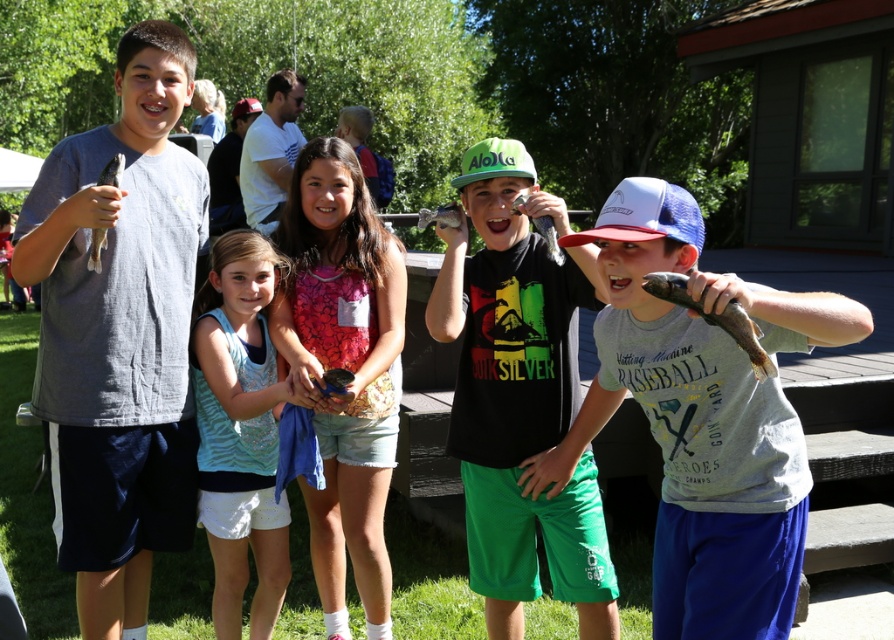
Does gray matte shirt at left have a greater width compared to shiny metallic fish at center?

No, gray matte shirt at left is not wider than shiny metallic fish at center.

Find the location of a particular element. This screenshot has width=894, height=640. gray matte shirt at left is located at coordinates (119, 333).

Between point (136, 429) and point (537, 330), which one is positioned in front?

Point (537, 330) is more forward.

Where is `gray matte shirt at left`? The width and height of the screenshot is (894, 640). gray matte shirt at left is located at coordinates (119, 333).

Does gray matte shirt at left appear on the right side of light blue fabric tank top at center?

Incorrect, gray matte shirt at left is not on the right side of light blue fabric tank top at center.

Locate an element on the screen. gray matte shirt at left is located at coordinates (119, 333).

Which is in front, point (94, 552) or point (235, 328)?

Point (94, 552) is in front.

I want to click on gray matte shirt at left, so click(119, 333).

Is gray matte shirt at left bigger than gray matte shirt at center?

Yes, gray matte shirt at left is bigger than gray matte shirt at center.

Who is shorter, gray matte shirt at left or gray matte shirt at center?

gray matte shirt at center is shorter.

Is point (132, 554) behind point (772, 445)?

Yes, it is.

Image resolution: width=894 pixels, height=640 pixels. Find the location of `gray matte shirt at left`. gray matte shirt at left is located at coordinates (119, 333).